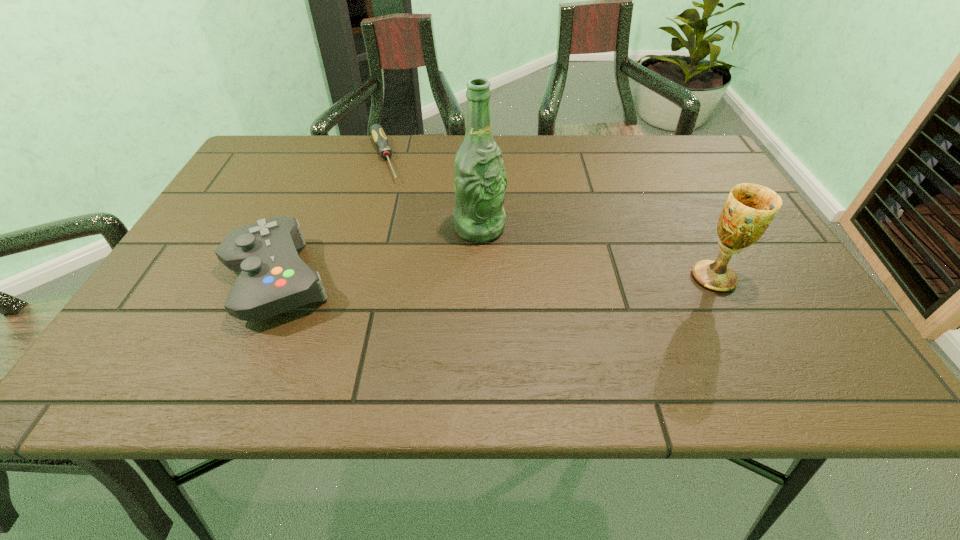
Where is `vacant space located 0.280m on the surface of the beer bottle`? vacant space located 0.280m on the surface of the beer bottle is located at coordinates click(x=584, y=320).

Find the location of a particular element. The image size is (960, 540). free region located on the surface of the beer bottle is located at coordinates (512, 256).

The image size is (960, 540). I want to click on free spot located 0.230m insert the shortest object into a screw head, so click(404, 236).

The width and height of the screenshot is (960, 540). What are the coordinates of `vacant space situated 0.310m insert the shortest object into a screw head` in the screenshot? It's located at (412, 259).

Image resolution: width=960 pixels, height=540 pixels. What are the coordinates of `free region located insert the shortest object into a screw head` in the screenshot? It's located at (422, 287).

Where is `object present at the far edge`? The height and width of the screenshot is (540, 960). object present at the far edge is located at coordinates (376, 130).

Where is `object that is positioned at the near edge`? object that is positioned at the near edge is located at coordinates (273, 279).

Locate an element on the screen. The height and width of the screenshot is (540, 960). object that is positioned at the left edge is located at coordinates (273, 279).

Where is `object located at the right edge`? object located at the right edge is located at coordinates (750, 208).

At what (x,y) coordinates should I click in order to perform the action: click on object at the near left corner. Please return your answer as a coordinate pair (x, y). The width and height of the screenshot is (960, 540). Looking at the image, I should click on (273, 279).